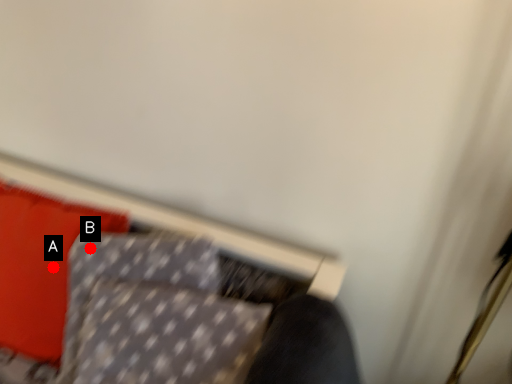
Question: Two points are circled on the image, labeled by A and B beside each circle. Among these points, which one is nearest to the camera?

Choices:
 (A) A is closer
 (B) B is closer

Answer: (B)